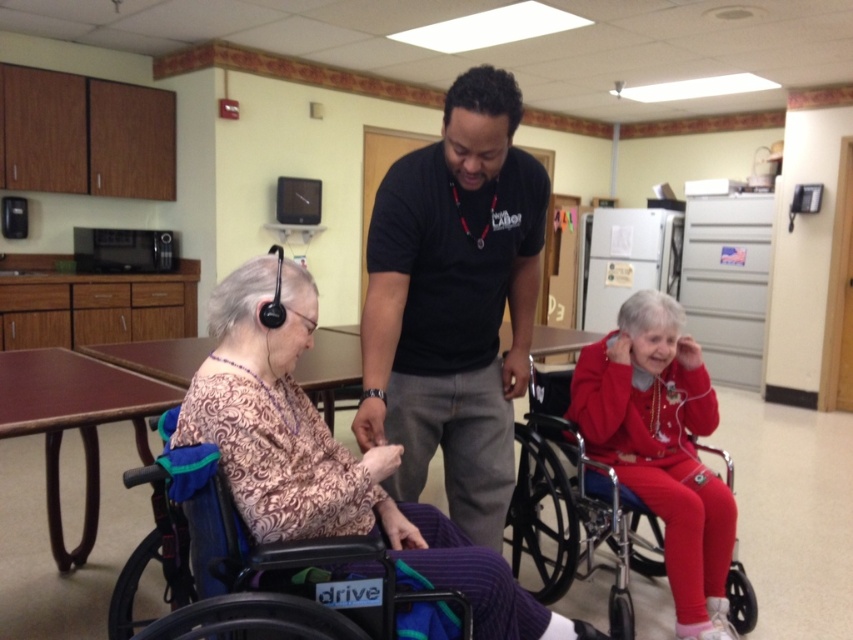
You are organizing a space and need to place the black cotton shirt at center and the metallic silver wheelchair at lower right. Given their sizes, which object should you allocate more space for?

The metallic silver wheelchair at lower right requires more space because it is larger than the black cotton shirt at center.

You are a caregiver who needs to hand a water bottle to the person in the black cotton shirt at center. The water bottle is currently placed on the patterned fabric wheelchair at left. Can you reach the water bottle without moving from your current position?

The black cotton shirt at center and patterned fabric wheelchair at left are 13.81 inches apart. Since the distance between them is less than an average person arm length, you can reach the water bottle without moving.

You are a photographer positioned at the back of the room. You want to take a clear photo of the black cotton shirt at center without the metallic silver wheelchair at lower right blocking the view. Is this possible based on their positions?

The black cotton shirt at center is closer to the viewer than the metallic silver wheelchair at lower right, so the wheelchair will block the view of the shirt. Therefore, it is not possible to take a clear photo of the black cotton shirt at center without the metallic silver wheelchair at lower right blocking the view.